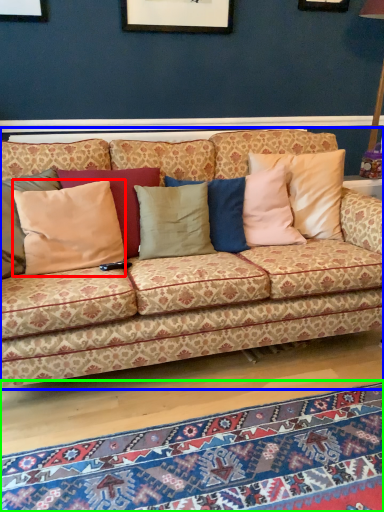
Question: Based on their relative distances, which object is farther from pillow (highlighted by a red box)? Choose from studio couch (highlighted by a blue box) and mat (highlighted by a green box).

Choices:
 (A) studio couch
 (B) mat

Answer: (B)